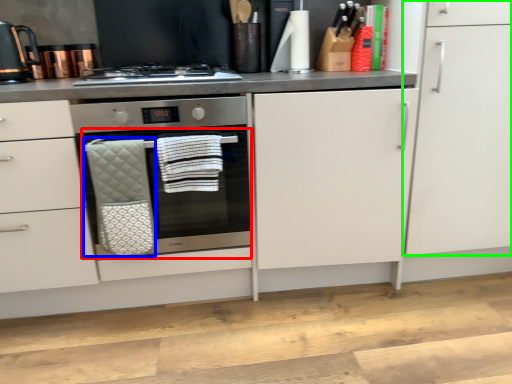
Question: Estimate the real-world distances between objects in this image. Which object is closer to oven (highlighted by a red box), hand towel (highlighted by a blue box) or cabinetry (highlighted by a green box)?

Choices:
 (A) hand towel
 (B) cabinetry

Answer: (A)